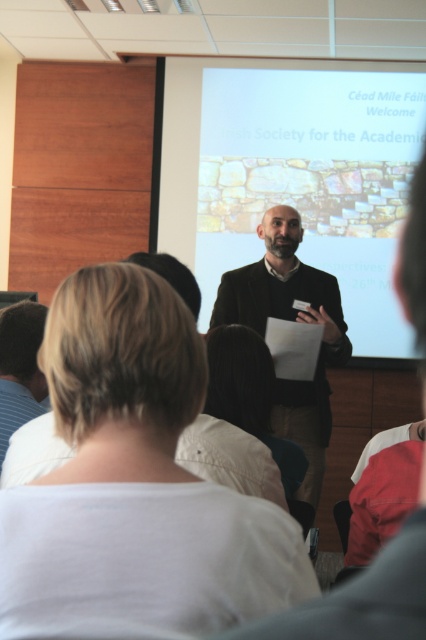
Looking at this image, which of these two, white cotton shirt at center or dark brown hair at lower left, stands shorter?

white cotton shirt at center

Does white cotton shirt at center have a larger size compared to dark brown hair at lower left?

Yes, white cotton shirt at center is bigger than dark brown hair at lower left.

Does point (111, 579) come in front of point (9, 372)?

Yes.

Locate an element on the screen. This screenshot has height=640, width=426. white cotton shirt at center is located at coordinates [x=135, y=484].

Measure the distance between point (351, 232) and camera.

Point (351, 232) is 4.34 meters from camera.

Can you confirm if matte stone wall at center is thinner than dark brown hair at lower left?

No, matte stone wall at center is not thinner than dark brown hair at lower left.

Where is `matte stone wall at center`? This screenshot has width=426, height=640. matte stone wall at center is located at coordinates (311, 180).

Who is positioned more to the right, white cotton shirt at center or matte stone wall at center?

Positioned to the right is matte stone wall at center.

How much distance is there between white cotton shirt at center and matte stone wall at center?

They are 11.93 feet apart.

Is point (83, 481) positioned in front of point (224, 120)?

Yes.

Image resolution: width=426 pixels, height=640 pixels. I want to click on white cotton shirt at center, so click(135, 484).